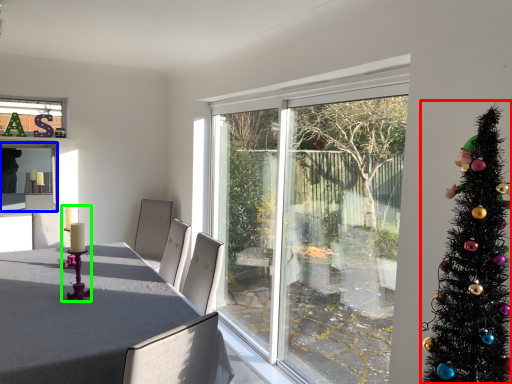
Question: Which object is the closest to the christmas tree (highlighted by a red box)? Choose among these: window screen (highlighted by a blue box) or candle holder (highlighted by a green box).

Choices:
 (A) window screen
 (B) candle holder

Answer: (B)